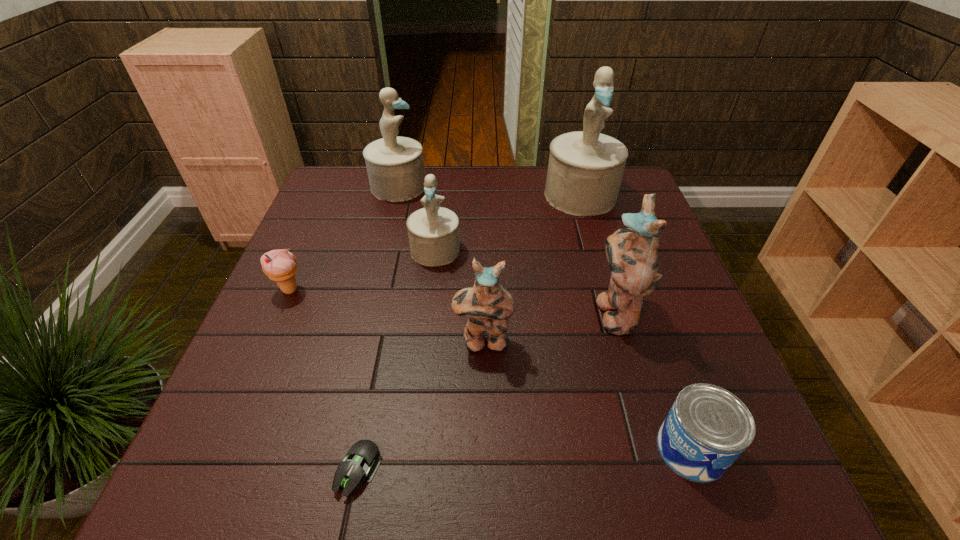
At what (x,y) coordinates should I click in order to perform the action: click on object positioned at the far left corner. Please return your answer as a coordinate pair (x, y). Image resolution: width=960 pixels, height=540 pixels. Looking at the image, I should click on (395, 167).

You are a GUI agent. You are given a task and a screenshot of the screen. Output one action in this format:
    pyautogui.click(x=<x>, y=<y>)
    Task: Click on the object that is at the far right corner
    
    Given the screenshot: What is the action you would take?
    pyautogui.click(x=585, y=169)

Where is `object present at the near right corner`? The height and width of the screenshot is (540, 960). object present at the near right corner is located at coordinates (707, 428).

What are the coordinates of `free region at the far edge of the desktop` in the screenshot? It's located at (390, 203).

Where is `vacant space at the near edge`? This screenshot has width=960, height=540. vacant space at the near edge is located at coordinates (629, 464).

The image size is (960, 540). Find the location of `vacant area at the left edge of the desktop`. vacant area at the left edge of the desktop is located at coordinates (263, 359).

In order to click on vacant space at the right edge of the desktop in this screenshot , I will do `click(600, 220)`.

You are a GUI agent. You are given a task and a screenshot of the screen. Output one action in this format:
    pyautogui.click(x=<x>, y=<y>)
    Task: Click on the blank space at the far left corner of the desktop
    This screenshot has width=960, height=540.
    Given the screenshot: What is the action you would take?
    pyautogui.click(x=364, y=183)

You are a GUI agent. You are given a task and a screenshot of the screen. Output one action in this format:
    pyautogui.click(x=<x>, y=<y>)
    Task: Click on the empty space between the can and the leftmost object
    Image resolution: width=960 pixels, height=540 pixels.
    Given the screenshot: What is the action you would take?
    pyautogui.click(x=491, y=369)

I want to click on free space between the biggest white figurine and the left pink figurine, so click(532, 268).